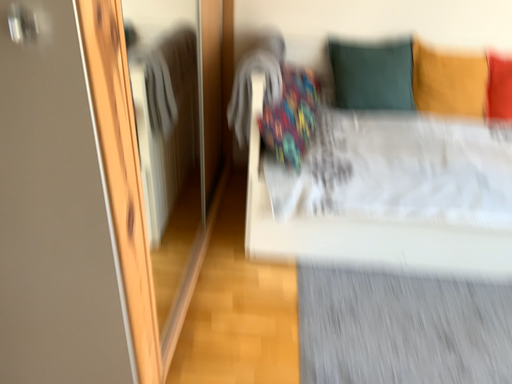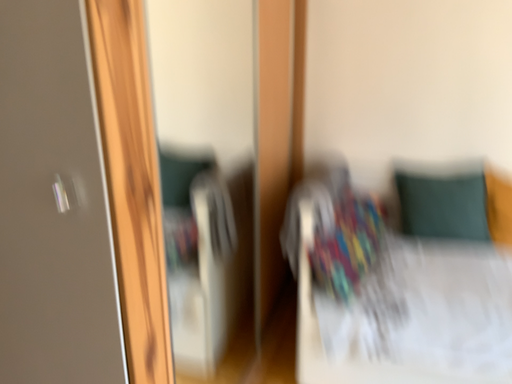
Question: How did the camera likely rotate when shooting the video?

Choices:
 (A) rotated downward
 (B) rotated upward

Answer: (B)